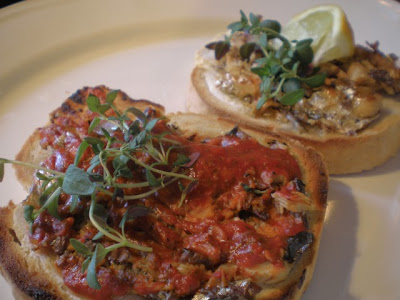
At what (x,y) coordinates should I click in order to perform the action: click on plate. Please return your answer as a coordinate pair (x, y). The height and width of the screenshot is (300, 400). Looking at the image, I should click on (133, 74), (357, 243).